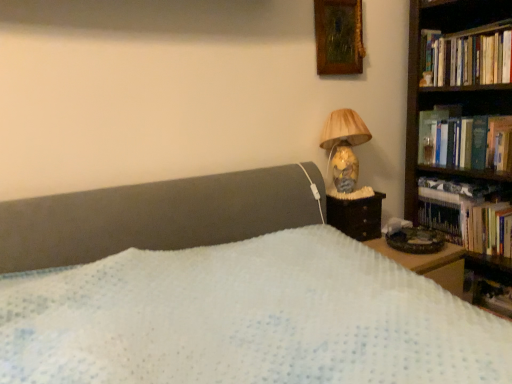
The height and width of the screenshot is (384, 512). Describe the element at coordinates (429, 134) in the screenshot. I see `hardcover book at upper right` at that location.

You are a GUI agent. You are given a task and a screenshot of the screen. Output one action in this format:
    pyautogui.click(x=<x>, y=<y>)
    Task: Click on the hardcover books at right, which ranks as the third book in top-to-bottom order
    Image resolution: width=512 pixels, height=384 pixels.
    Given the screenshot: What is the action you would take?
    pyautogui.click(x=466, y=215)

This screenshot has height=384, width=512. Describe the element at coordinates (466, 215) in the screenshot. I see `hardcover books at right, which appears as the first book when ordered from the bottom` at that location.

What do you see at coordinates (343, 147) in the screenshot? The width and height of the screenshot is (512, 384). I see `matte yellow lampshade at upper right` at bounding box center [343, 147].

Where is `hardcover book at right, positioned as the second book in top-to-bottom order`? hardcover book at right, positioned as the second book in top-to-bottom order is located at coordinates (465, 141).

Locate an element on the screen. The width and height of the screenshot is (512, 384). hardcover book at upper right is located at coordinates (429, 134).

Is wooden framed painting at upper right wider than hardcover books at right, positioned as the 1th book in top-to-bottom order?

Incorrect, the width of wooden framed painting at upper right does not surpass that of hardcover books at right, positioned as the 1th book in top-to-bottom order.

Is wooden framed painting at upper right taller than hardcover books at right, which is the third book in bottom-to-top order?

Indeed, wooden framed painting at upper right has a greater height compared to hardcover books at right, which is the third book in bottom-to-top order.

Considering the relative positions of wooden framed painting at upper right and hardcover books at right, which is the third book in bottom-to-top order, in the image provided, is wooden framed painting at upper right to the left or to the right of hardcover books at right, which is the third book in bottom-to-top order,?

From the image, it's evident that wooden framed painting at upper right is to the left of hardcover books at right, which is the third book in bottom-to-top order.

Based on the photo, is hardcover books at right, positioned as the 1th book in top-to-bottom order, further to camera compared to hardcover book at right, positioned as the second book in top-to-bottom order?

No, it is not.

Could you measure the distance between hardcover books at right, positioned as the 1th book in top-to-bottom order, and hardcover book at right, positioned as the second book in top-to-bottom order?

10.38 inches.

Is hardcover books at right, positioned as the 1th book in top-to-bottom order, situated inside hardcover book at right, which appears as the 2th book when ordered from the bottom, or outside?

hardcover books at right, positioned as the 1th book in top-to-bottom order, is outside hardcover book at right, which appears as the 2th book when ordered from the bottom.

From a real-world perspective, is hardcover books at right, which is the third book in bottom-to-top order, positioned over hardcover book at right, which appears as the 2th book when ordered from the bottom, based on gravity?

Indeed, from a real-world perspective, hardcover books at right, which is the third book in bottom-to-top order, stands above hardcover book at right, which appears as the 2th book when ordered from the bottom.

How much distance is there between hardcover book at upper right and hardcover books at right, which appears as the first book when ordered from the bottom?

The distance of hardcover book at upper right from hardcover books at right, which appears as the first book when ordered from the bottom, is 11.00 inches.

Can you confirm if hardcover book at upper right is positioned to the right of hardcover books at right, which ranks as the third book in top-to-bottom order?

No.

In terms of width, does hardcover book at upper right look wider or thinner when compared to hardcover books at right, which appears as the first book when ordered from the bottom?

hardcover book at upper right is thinner than hardcover books at right, which appears as the first book when ordered from the bottom.

Is point (425, 134) behind point (500, 252)?

Yes, it is behind point (500, 252).

From the image's perspective, is hardcover books at right, which appears as the first book when ordered from the bottom, above hardcover book at right, positioned as the second book in top-to-bottom order?

Incorrect, from the image's perspective, hardcover books at right, which appears as the first book when ordered from the bottom, is lower than hardcover book at right, positioned as the second book in top-to-bottom order.

Could you tell me if hardcover books at right, which ranks as the third book in top-to-bottom order, is facing hardcover book at right, positioned as the second book in top-to-bottom order?

No, hardcover books at right, which ranks as the third book in top-to-bottom order, is not oriented towards hardcover book at right, positioned as the second book in top-to-bottom order.

Which book is the 2nd one when counting from the left side of the hardcover book at right, positioned as the second book in top-to-bottom order? Please provide its 2D coordinates.

[(466, 215)]

Can you tell me how much hardcover books at right, which appears as the first book when ordered from the bottom, and hardcover book at right, positioned as the second book in top-to-bottom order, differ in facing direction?

There is a 2.26-degree angle between the facing directions of hardcover books at right, which appears as the first book when ordered from the bottom, and hardcover book at right, positioned as the second book in top-to-bottom order.

Which is more to the left, matte yellow lampshade at upper right or hardcover books at right, which is the third book in bottom-to-top order?

matte yellow lampshade at upper right is more to the left.

Image resolution: width=512 pixels, height=384 pixels. What are the coordinates of `the 1st book behind the matte yellow lampshade at upper right` in the screenshot? It's located at (467, 56).

In the image, is matte yellow lampshade at upper right positioned in front of or behind hardcover books at right, which is the third book in bottom-to-top order?

matte yellow lampshade at upper right is positioned closer to the viewer than hardcover books at right, which is the third book in bottom-to-top order.

Is matte yellow lampshade at upper right far from hardcover books at right, positioned as the 1th book in top-to-bottom order?

Actually, matte yellow lampshade at upper right and hardcover books at right, positioned as the 1th book in top-to-bottom order, are a little close together.

Is point (486, 127) in front of point (465, 233)?

Yes, it is.

Between hardcover book at right, positioned as the second book in top-to-bottom order, and hardcover books at right, which ranks as the third book in top-to-bottom order, which one is positioned behind?

hardcover books at right, which ranks as the third book in top-to-bottom order, is further away from the camera.

Is hardcover books at right, which ranks as the third book in top-to-bottom order, at the back of hardcover book at right, which appears as the 2th book when ordered from the bottom?

No, hardcover book at right, which appears as the 2th book when ordered from the bottom, is not facing away from hardcover books at right, which ranks as the third book in top-to-bottom order.

Is hardcover book at right, which appears as the 2th book when ordered from the bottom, at the left side of wooden framed painting at upper right?

No.

Choose the correct answer: Is hardcover book at right, which appears as the 2th book when ordered from the bottom, inside wooden framed painting at upper right or outside it?

hardcover book at right, which appears as the 2th book when ordered from the bottom, cannot be found inside wooden framed painting at upper right.

From the image's perspective, relative to wooden framed painting at upper right, is hardcover book at right, which appears as the 2th book when ordered from the bottom, above or below?

Based on their image positions, hardcover book at right, which appears as the 2th book when ordered from the bottom, is located beneath wooden framed painting at upper right.

Is hardcover book at right, positioned as the second book in top-to-bottom order, touching wooden framed painting at upper right?

No, hardcover book at right, positioned as the second book in top-to-bottom order, is not next to wooden framed painting at upper right.

Locate an element on the screen. picture frame on the left of hardcover books at right, which is the third book in bottom-to-top order is located at coordinates (338, 37).

There is a hardcover books at right, positioned as the 1th book in top-to-bottom order. What are the coordinates of `the 1st book below it (from a real-world perspective)` in the screenshot? It's located at (465, 141).

Which object lies nearer to the anchor point hardcover book at upper right, wooden bookshelf at right or matte yellow lampshade at upper right?

matte yellow lampshade at upper right is closer to hardcover book at upper right.

Considering their positions, is wooden bookshelf at right positioned further to hardcover books at right, positioned as the 1th book in top-to-bottom order, than hardcover books at right, which appears as the first book when ordered from the bottom?

wooden bookshelf at right is further to hardcover books at right, positioned as the 1th book in top-to-bottom order.

When comparing their distances from matte yellow lampshade at upper right, does wooden framed painting at upper right or hardcover book at right, which appears as the 2th book when ordered from the bottom, seem closer?

Among the two, wooden framed painting at upper right is located nearer to matte yellow lampshade at upper right.

Considering their positions, is matte yellow lampshade at upper right positioned closer to hardcover books at right, which ranks as the third book in top-to-bottom order, than hardcover books at right, positioned as the 1th book in top-to-bottom order?

matte yellow lampshade at upper right is positioned closer to the anchor hardcover books at right, which ranks as the third book in top-to-bottom order.

When comparing their distances from wooden framed painting at upper right, does hardcover books at right, which is the third book in bottom-to-top order, or dark wood nightstand at right seem closer?

hardcover books at right, which is the third book in bottom-to-top order, is positioned closer to the anchor wooden framed painting at upper right.

Which object lies further to the anchor point matte yellow lampshade at upper right, hardcover books at right, which is the third book in bottom-to-top order, or hardcover book at right, positioned as the second book in top-to-bottom order?

Based on the image, hardcover books at right, which is the third book in bottom-to-top order, appears to be further to matte yellow lampshade at upper right.

Looking at the image, which one is located closer to matte yellow lampshade at upper right, hardcover book at right, which appears as the 2th book when ordered from the bottom, or hardcover books at right, which is the third book in bottom-to-top order?

Among the two, hardcover book at right, which appears as the 2th book when ordered from the bottom, is located nearer to matte yellow lampshade at upper right.

Estimate the real-world distances between objects in this image. Which object is closer to wooden bookshelf at right, dark wood nightstand at right or wooden framed painting at upper right?

dark wood nightstand at right is positioned closer to the anchor wooden bookshelf at right.

Find the location of a particular element. This screenshot has width=512, height=384. nightstand located between matte yellow lampshade at upper right and hardcover book at upper right in the left-right direction is located at coordinates (356, 216).

The width and height of the screenshot is (512, 384). In order to click on lamp located between wooden framed painting at upper right and hardcover book at right, positioned as the second book in top-to-bottom order, in the left-right direction in this screenshot , I will do `click(343, 147)`.

What are the coordinates of `lamp located between wooden framed painting at upper right and hardcover books at right, which is the third book in bottom-to-top order, in the left-right direction` in the screenshot? It's located at (343, 147).

Locate an element on the screen. lamp between wooden framed painting at upper right and hardcover books at right, which ranks as the third book in top-to-bottom order, from top to bottom is located at coordinates (343, 147).